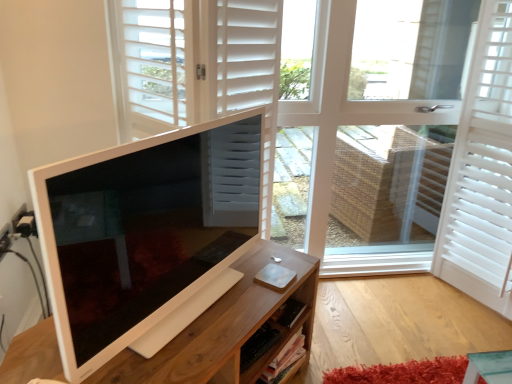
Question: Should I look upward or downward to see white matte door at center?

Choices:
 (A) down
 (B) up

Answer: (B)

Question: Considering the relative sizes of white glossy computer monitor at left and white matte window at center in the image provided, is white glossy computer monitor at left thinner than white matte window at center?

Choices:
 (A) no
 (B) yes

Answer: (B)

Question: From the image's perspective, would you say white glossy computer monitor at left is positioned over white matte window at center?

Choices:
 (A) yes
 (B) no

Answer: (B)

Question: Can you confirm if white glossy computer monitor at left is positioned to the right of white matte window at center?

Choices:
 (A) yes
 (B) no

Answer: (B)

Question: Are white glossy computer monitor at left and white matte window at center making contact?

Choices:
 (A) no
 (B) yes

Answer: (A)

Question: Considering the relative sizes of white glossy computer monitor at left and white matte window at center in the image provided, is white glossy computer monitor at left smaller than white matte window at center?

Choices:
 (A) yes
 (B) no

Answer: (A)

Question: Are white glossy computer monitor at left and white matte window at center located far from each other?

Choices:
 (A) no
 (B) yes

Answer: (A)

Question: Considering the relative positions of wooden desk at center and white matte shutter at right in the image provided, is wooden desk at center to the right of white matte shutter at right from the viewer's perspective?

Choices:
 (A) no
 (B) yes

Answer: (A)

Question: Considering the relative positions of wooden desk at center and white matte shutter at right in the image provided, is wooden desk at center to the left of white matte shutter at right from the viewer's perspective?

Choices:
 (A) yes
 (B) no

Answer: (A)

Question: Can you confirm if wooden desk at center is bigger than white matte shutter at right?

Choices:
 (A) yes
 (B) no

Answer: (B)

Question: Is wooden desk at center positioned in front of white matte shutter at right?

Choices:
 (A) yes
 (B) no

Answer: (A)

Question: Is wooden desk at center far from white matte shutter at right?

Choices:
 (A) no
 (B) yes

Answer: (B)

Question: Does wooden desk at center have a greater height compared to white matte shutter at right?

Choices:
 (A) no
 (B) yes

Answer: (A)

Question: Considering the relative sizes of white matte door at center and wooden desk at center in the image provided, is white matte door at center bigger than wooden desk at center?

Choices:
 (A) yes
 (B) no

Answer: (A)